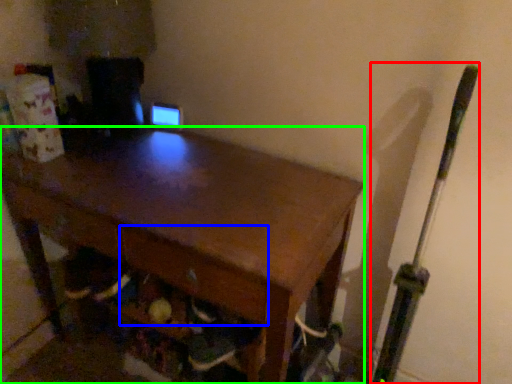
Question: Which is farther away from baseball bat (highlighted by a red box)? drawer (highlighted by a blue box) or desk (highlighted by a green box)?

Choices:
 (A) drawer
 (B) desk

Answer: (B)